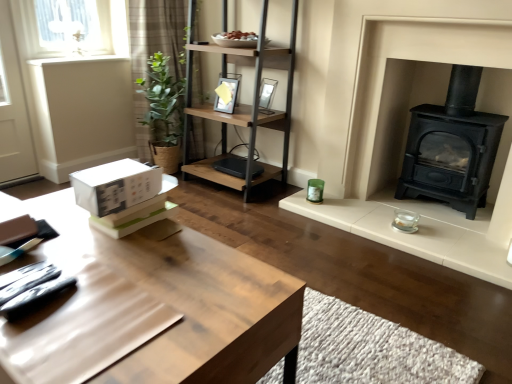
Question: From a real-world perspective, does matte black picture frame at upper center, the second picture frame when ordered from right to left, sit lower than light brown wooden table at center?

Choices:
 (A) yes
 (B) no

Answer: (B)

Question: Is matte black picture frame at upper center, the first picture frame viewed from the left, located outside light brown wooden table at center?

Choices:
 (A) no
 (B) yes

Answer: (B)

Question: Is matte black picture frame at upper center, the second picture frame when ordered from right to left, positioned far away from light brown wooden table at center?

Choices:
 (A) no
 (B) yes

Answer: (B)

Question: From a real-world perspective, does matte black picture frame at upper center, the first picture frame viewed from the left, stand above light brown wooden table at center?

Choices:
 (A) yes
 (B) no

Answer: (A)

Question: Considering the relative positions of matte black picture frame at upper center, the first picture frame viewed from the left, and light brown wooden table at center in the image provided, is matte black picture frame at upper center, the first picture frame viewed from the left, in front of light brown wooden table at center?

Choices:
 (A) yes
 (B) no

Answer: (B)

Question: From a real-world perspective, relative to light brown wooden table at center, is white matte cardboard box at lower left vertically above or below?

Choices:
 (A) above
 (B) below

Answer: (A)

Question: From the image's perspective, is white matte cardboard box at lower left positioned above or below light brown wooden table at center?

Choices:
 (A) below
 (B) above

Answer: (B)

Question: Based on their sizes in the image, would you say white matte cardboard box at lower left is bigger or smaller than light brown wooden table at center?

Choices:
 (A) small
 (B) big

Answer: (A)

Question: Considering the positions of white matte cardboard box at lower left and light brown wooden table at center in the image, is white matte cardboard box at lower left taller or shorter than light brown wooden table at center?

Choices:
 (A) short
 (B) tall

Answer: (A)

Question: Considering the positions of point (266, 109) and point (477, 152), is point (266, 109) closer or farther from the camera than point (477, 152)?

Choices:
 (A) closer
 (B) farther

Answer: (B)

Question: From a real-world perspective, is matte glass picture frame at upper center, placed as the first picture frame when sorted from right to left, above or below black cast iron wood burning stove at right?

Choices:
 (A) below
 (B) above

Answer: (B)

Question: Which is correct: matte glass picture frame at upper center, placed as the 2th picture frame when sorted from left to right, is inside black cast iron wood burning stove at right, or outside of it?

Choices:
 (A) inside
 (B) outside

Answer: (B)

Question: In terms of height, does matte glass picture frame at upper center, placed as the 2th picture frame when sorted from left to right, look taller or shorter compared to black cast iron wood burning stove at right?

Choices:
 (A) tall
 (B) short

Answer: (B)

Question: Is woodenmaterial/textureshelf at center bigger or smaller than white matte cardboard box at lower left?

Choices:
 (A) big
 (B) small

Answer: (A)

Question: Does point (288, 66) appear closer or farther from the camera than point (160, 185)?

Choices:
 (A) closer
 (B) farther

Answer: (B)